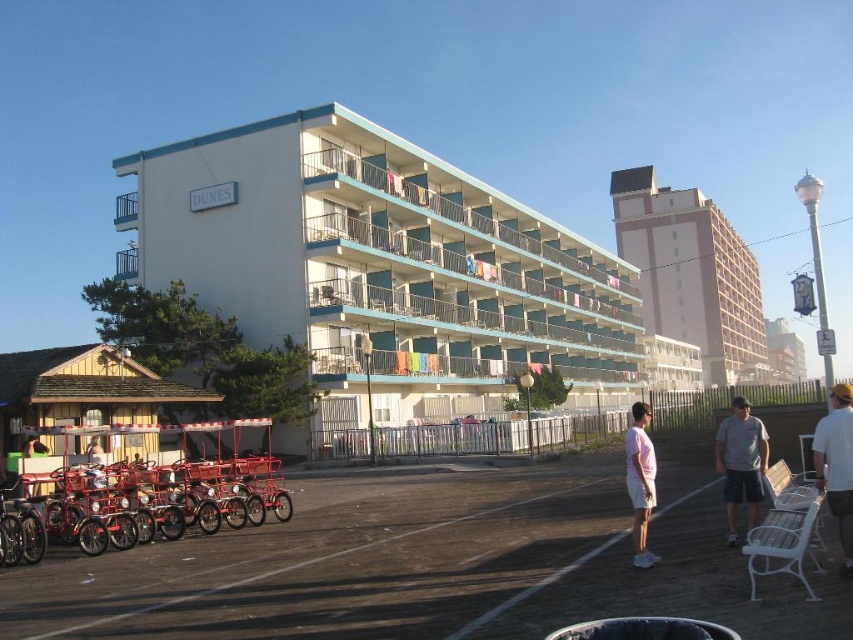
Can you confirm if white matte building at center is shorter than metallic red tricycles at lower left?

Incorrect, white matte building at center's height does not fall short of metallic red tricycles at lower left's.

Which of these two, white matte building at center or metallic red tricycles at lower left, stands shorter?

metallic red tricycles at lower left is shorter.

Does point (126, 264) come farther from viewer compared to point (347, 596)?

Yes.

Locate an element on the screen. Image resolution: width=853 pixels, height=640 pixels. white matte building at center is located at coordinates (379, 268).

Is metallic red tricycle at left to the left of tan fabric shirt at center from the viewer's perspective?

No, metallic red tricycle at left is not to the left of tan fabric shirt at center.

Who is lower down, metallic red tricycle at left or tan fabric shirt at center?

metallic red tricycle at left

Is point (160, 518) positioned behind point (91, 438)?

No, it is not.

Where is `metallic red tricycle at left`? This screenshot has width=853, height=640. metallic red tricycle at left is located at coordinates (137, 502).

Is metallic red tricycles at lower left wider than pink matte shirt at center?

Indeed, metallic red tricycles at lower left has a greater width compared to pink matte shirt at center.

What do you see at coordinates (426, 564) in the screenshot? I see `metallic red tricycles at lower left` at bounding box center [426, 564].

Identify the location of metallic red tricycles at lower left. (426, 564).